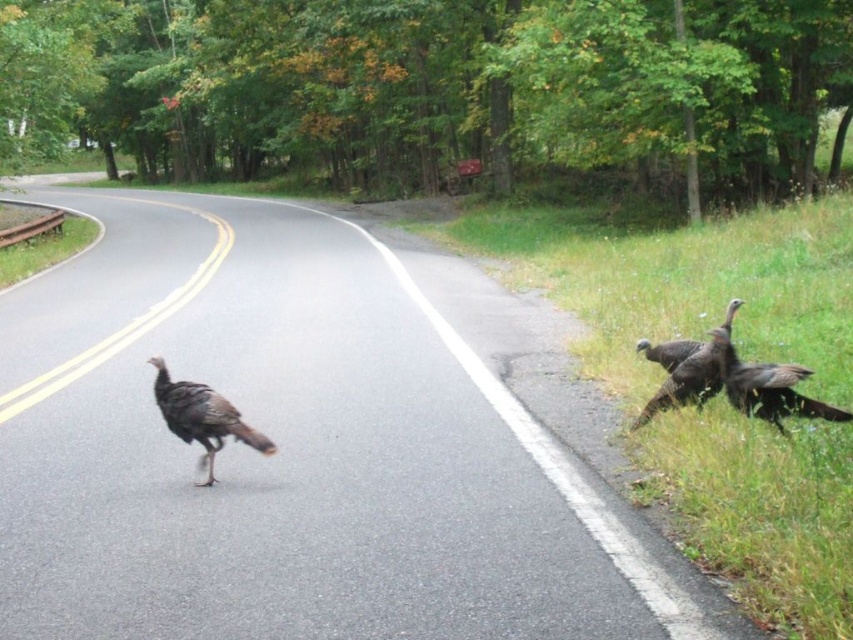
You are a driver approaching the black asphalt highway at center and notice the dark brown feathers at right. Which object is nearer to your car?

The black asphalt highway at center is closer to the viewer than the dark brown feathers at right, so the highway is nearer to your car.

You are a driver approaching the road with two turkey feather clusters in view. The brown speckled feathers at road center and the dark brown feathers at right are both on the asphalt. Which cluster has a larger spread? Please answer based on their widths.

The brown speckled feathers at road center has a larger spread than the dark brown feathers at right because its width surpasses the other as stated.

You are a driver approaching the black asphalt highway at center and notice the brown speckled feathers at road center. Which object would you see first as you drive towards them?

The black asphalt highway at center would be seen first because it is larger in size than the brown speckled feathers at road center, making it more prominent in the driver view.